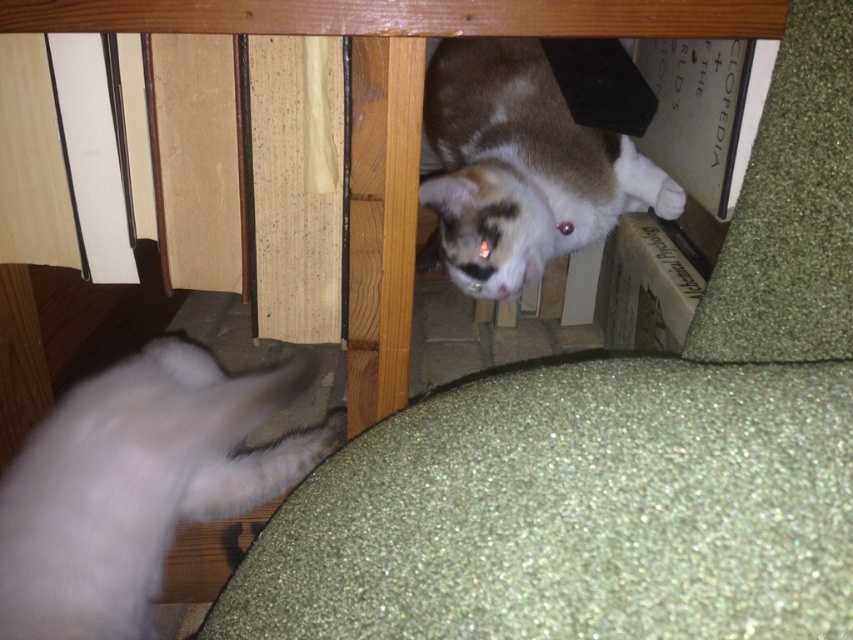
You are a cat owner trying to separate your two cats. You see the white fluffy cat at lower left and the calico fur cat at upper center. Which cat should you approach first to ensure you can reach them without disturbing the other?

You should approach the white fluffy cat at lower left first because it is closer to you than the calico fur cat at upper center, making it easier to reach without disturbing the other cat.

Looking at this image, you are a cat owner who wants to place a new cat bed in the space between the white fluffy cat at lower left and the calico fur cat at upper center. Considering their sizes, which cat might require a larger bed to accommodate its size?

The white fluffy cat at lower left requires a larger bed because its width is greater than the calico fur cat at upper center.

You are a cat owner trying to determine which of your cats is smaller. You have a white fluffy cat at lower left and a calico fur cat at upper center in the image. Based on the scene, which cat is smaller?

The white fluffy cat at lower left is smaller than the calico fur cat at upper center according to the description.